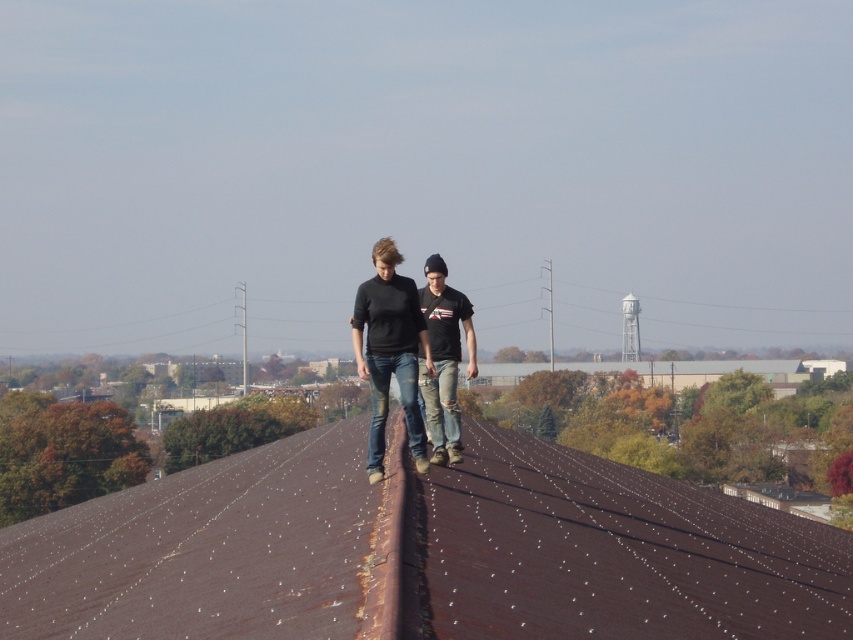
Is point (373, 298) closer to viewer compared to point (469, 317)?

Yes, point (373, 298) is closer to viewer.

Describe the element at coordinates (403, 342) in the screenshot. I see `denim jeans at center` at that location.

Does point (363, 316) come in front of point (454, 330)?

Yes.

Locate an element on the screen. The image size is (853, 640). denim jeans at center is located at coordinates click(x=403, y=342).

Is point (514, 541) closer to camera compared to point (421, 349)?

Yes, point (514, 541) is closer to viewer.

Does brown rusted metal roof at center appear under denim jeans at center?

Correct, brown rusted metal roof at center is located below denim jeans at center.

Identify the location of brown rusted metal roof at center. Image resolution: width=853 pixels, height=640 pixels. (421, 552).

The width and height of the screenshot is (853, 640). In order to click on brown rusted metal roof at center in this screenshot , I will do `click(421, 552)`.

Measure the distance between brown rusted metal roof at center and ripped denim jeans at center.

brown rusted metal roof at center is 4.19 meters from ripped denim jeans at center.

Does point (584, 456) come closer to viewer compared to point (436, 435)?

That is False.

Is point (535, 568) farther from viewer compared to point (457, 371)?

No, (535, 568) is in front of (457, 371).

Where is `brown rusted metal roof at center`? brown rusted metal roof at center is located at coordinates (421, 552).